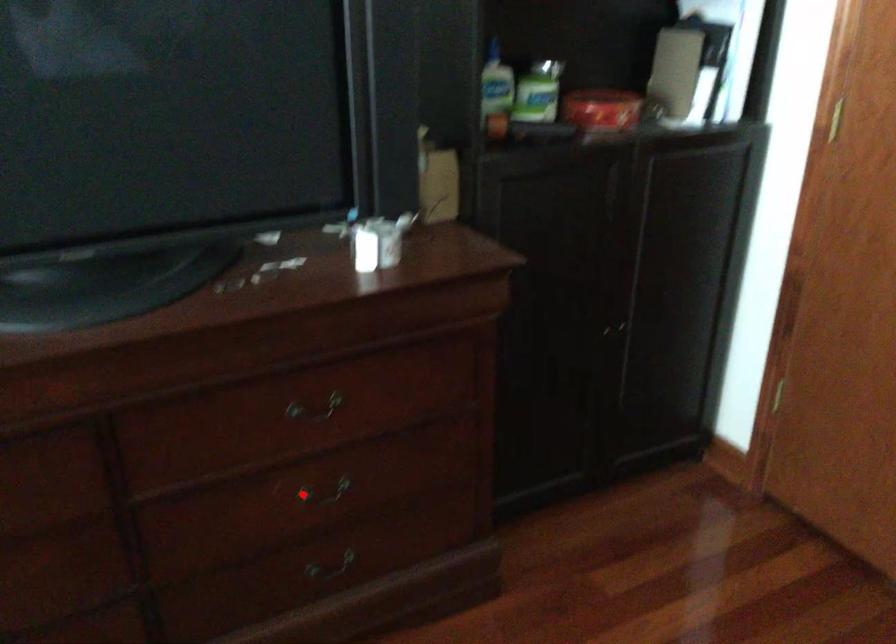
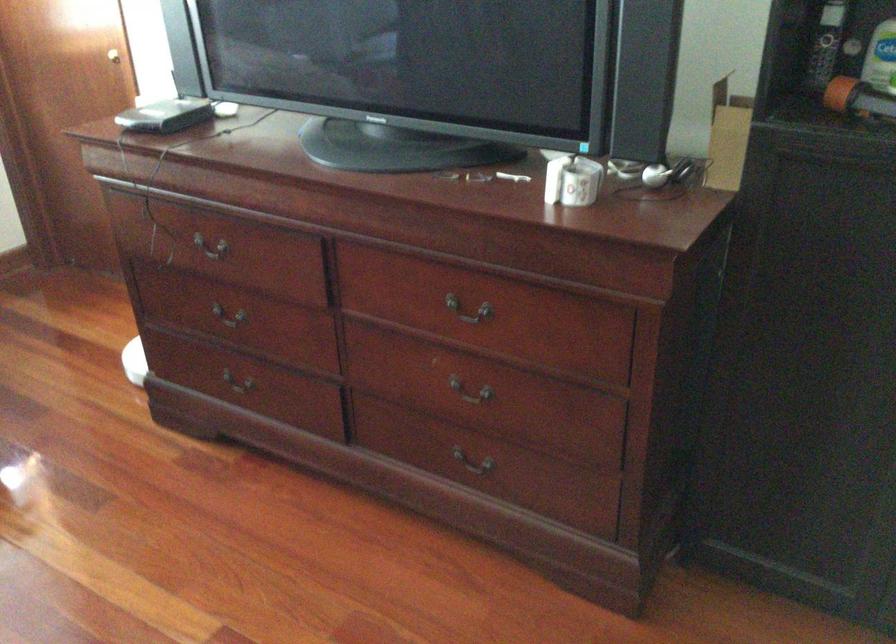
Find the pixel in the second image that matches the highlighted location in the first image.

(470, 392)